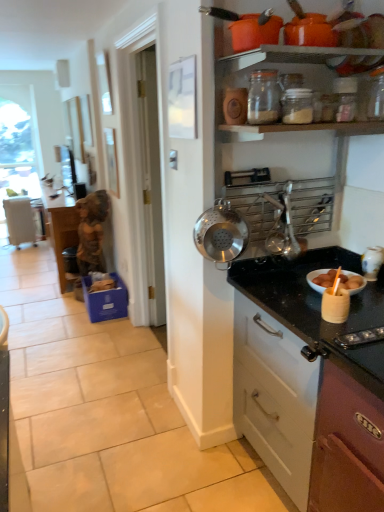
Question: Based on their positions, is stainless steel colander at upper right, which appears as the first kitchen appliance when ordered from the bottom, located to the left or right of metallic silver utensil rack at upper center?

Choices:
 (A) right
 (B) left

Answer: (B)

Question: Considering the positions of stainless steel colander at upper right, arranged as the 3th kitchen appliance when viewed from the top, and metallic silver utensil rack at upper center in the image, is stainless steel colander at upper right, arranged as the 3th kitchen appliance when viewed from the top, wider or thinner than metallic silver utensil rack at upper center?

Choices:
 (A) thin
 (B) wide

Answer: (A)

Question: Which of these objects is positioned closest to the stainless steel colander at upper right, arranged as the 3th kitchen appliance when viewed from the top?

Choices:
 (A) metallic silver utensil rack at upper center
 (B) clear glass jar at upper center, which is the second kitchen appliance from top to bottom
 (C) white ceramic jar at right
 (D) black granite countertop at right
 (E) clear glass jar at upper center, arranged as the 1th kitchen appliance when viewed from the top

Answer: (A)

Question: Considering the real-world distances, which object is closest to the black granite countertop at right?

Choices:
 (A) white ceramic jar at right
 (B) clear glass jar at upper center, which is the second kitchen appliance from top to bottom
 (C) stainless steel colander at upper right, arranged as the 3th kitchen appliance when viewed from the top
 (D) metallic silver utensil rack at upper center
 (E) clear glass jar at upper center, which is the third kitchen appliance in bottom-to-top order

Answer: (D)